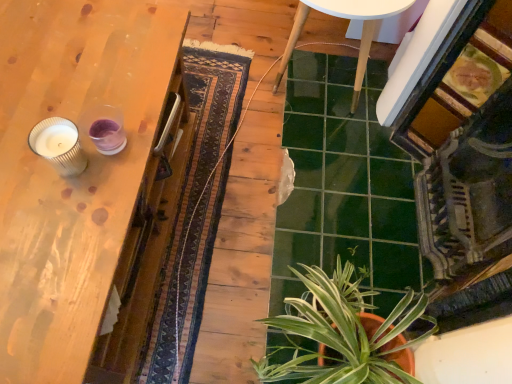
Question: Is wooden table at left inside or outside of ridged glass candle at left?

Choices:
 (A) inside
 (B) outside

Answer: (B)

Question: Considering the positions of point (12, 41) and point (62, 122), is point (12, 41) closer or farther from the camera than point (62, 122)?

Choices:
 (A) farther
 (B) closer

Answer: (A)

Question: Considering the real-world distances, which object is farthest from the ridged glass candle at left?

Choices:
 (A) white glossy table at center
 (B) green glossy plant at lower right
 (C) wooden table at left

Answer: (A)

Question: Estimate the real-world distances between objects in this image. Which object is farther from the green glossy plant at lower right?

Choices:
 (A) ridged glass candle at left
 (B) white glossy table at center
 (C) wooden table at left

Answer: (B)